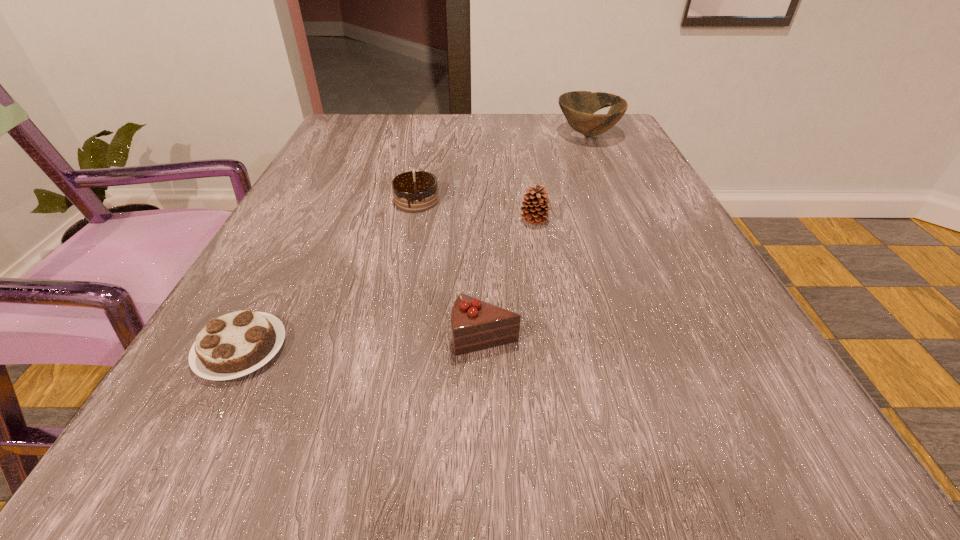
Find the location of a particular element. The image size is (960, 540). bowl is located at coordinates (578, 107).

Locate an element on the screen. This screenshot has height=540, width=960. the farthest object is located at coordinates (578, 107).

Identify the location of the fourth object from left to right. This screenshot has width=960, height=540. click(x=535, y=209).

What are the coordinates of `the third nearest object` in the screenshot? It's located at (535, 209).

Find the location of `the fourth object from right to left`. the fourth object from right to left is located at coordinates (415, 191).

Image resolution: width=960 pixels, height=540 pixels. Identify the location of the second chocolate cake from left to right. (415, 191).

In order to click on the rightmost chocolate cake in this screenshot , I will do (x=475, y=325).

Locate an element on the screen. This screenshot has height=540, width=960. the shortest chocolate cake is located at coordinates (235, 344).

I want to click on the shortest object, so coord(235,344).

This screenshot has height=540, width=960. I want to click on free point located on the front of the bowl, so click(613, 191).